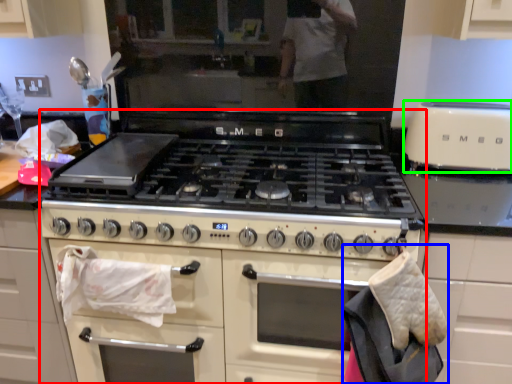
Question: Estimate the real-world distances between objects in this image. Which object is closer to appliance (highlighted by a red box), material (highlighted by a blue box) or kitchen appliance (highlighted by a green box)?

Choices:
 (A) material
 (B) kitchen appliance

Answer: (A)